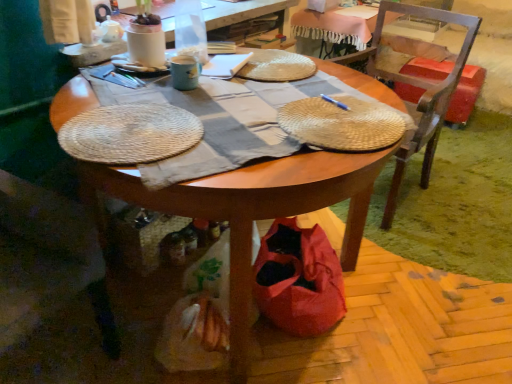
Identify the location of vacant area that lies between matte ceramic mug at upper center and woven straw placemat at center. Image resolution: width=512 pixels, height=384 pixels. (239, 92).